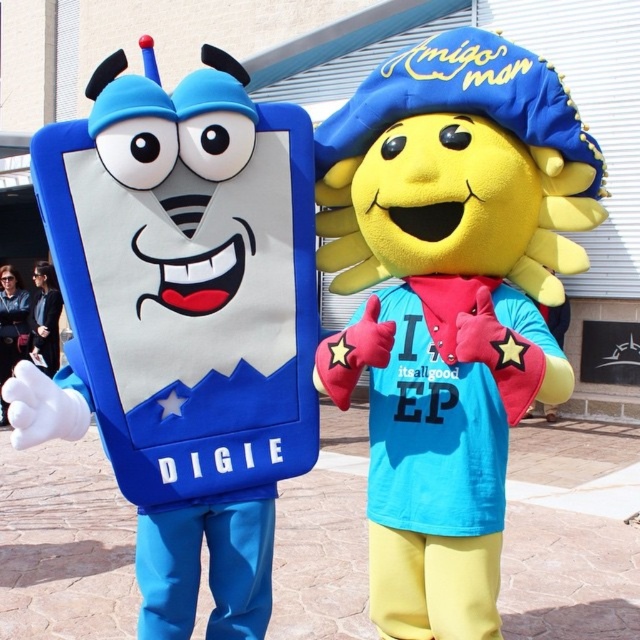
You are a visitor at the Amigo Man building and see the matte blue phone at left and the black fabric jacket at lower left. Which object is positioned lower in the image?

The matte blue phone at left is located below the black fabric jacket at lower left, so it is positioned lower in the image.

Consider the image. You are a photographer standing in front of the Amigo Man building. You want to take a photo that includes both the yellow plush sun at center and the black fabric jacket at lower left. Which object should you adjust your camera angle to focus on first to ensure both are in frame?

The yellow plush sun at center is closer to the viewer than the black fabric jacket at lower left, so you should focus on the yellow plush sun at center first to ensure both are in frame.

From the picture: You are standing at the base of the Amigo Man building and see the yellow plush sun at center and the black fabric jacket at lower left. If you want to place a 7 meter long banner between them, will it reach from one to the other?

The distance between the yellow plush sun at center and the black fabric jacket at lower left is 6.74 meters, so a 7 meter long banner would be too long to fit between them.